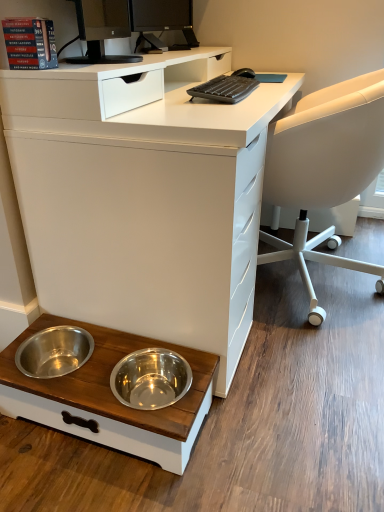
Question: Should I look upward or downward to see wooden pet bowls at lower left?

Choices:
 (A) down
 (B) up

Answer: (A)

Question: Would you say black plastic keyboard at upper center contains white matte desk at lower left?

Choices:
 (A) no
 (B) yes

Answer: (A)

Question: Is black plastic keyboard at upper center not close to white matte desk at lower left?

Choices:
 (A) yes
 (B) no

Answer: (B)

Question: Is black plastic keyboard at upper center smaller than white matte desk at lower left?

Choices:
 (A) no
 (B) yes

Answer: (B)

Question: Considering the relative positions of black plastic keyboard at upper center and white matte desk at lower left in the image provided, is black plastic keyboard at upper center behind white matte desk at lower left?

Choices:
 (A) yes
 (B) no

Answer: (A)

Question: Can you confirm if black plastic keyboard at upper center is shorter than white matte desk at lower left?

Choices:
 (A) no
 (B) yes

Answer: (B)

Question: From the image's perspective, does black plastic keyboard at upper center appear higher than white matte desk at lower left?

Choices:
 (A) no
 (B) yes

Answer: (B)

Question: Considering the relative sizes of wooden pet bowls at lower left and white plastic chair at right in the image provided, is wooden pet bowls at lower left taller than white plastic chair at right?

Choices:
 (A) no
 (B) yes

Answer: (A)

Question: Is the depth of wooden pet bowls at lower left greater than that of white plastic chair at right?

Choices:
 (A) yes
 (B) no

Answer: (B)

Question: From the image's perspective, does wooden pet bowls at lower left appear lower than white plastic chair at right?

Choices:
 (A) yes
 (B) no

Answer: (A)

Question: Is wooden pet bowls at lower left outside white plastic chair at right?

Choices:
 (A) yes
 (B) no

Answer: (A)

Question: Considering the relative positions of wooden pet bowls at lower left and white plastic chair at right in the image provided, is wooden pet bowls at lower left to the right of white plastic chair at right from the viewer's perspective?

Choices:
 (A) no
 (B) yes

Answer: (A)

Question: Is wooden pet bowls at lower left looking in the opposite direction of white plastic chair at right?

Choices:
 (A) no
 (B) yes

Answer: (A)

Question: Can you confirm if black glossy monitor at upper center is bigger than black plastic keyboard at upper center?

Choices:
 (A) yes
 (B) no

Answer: (A)